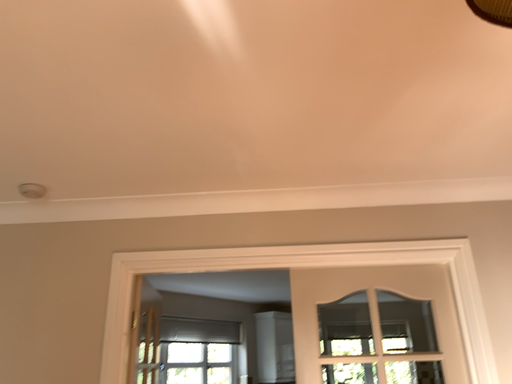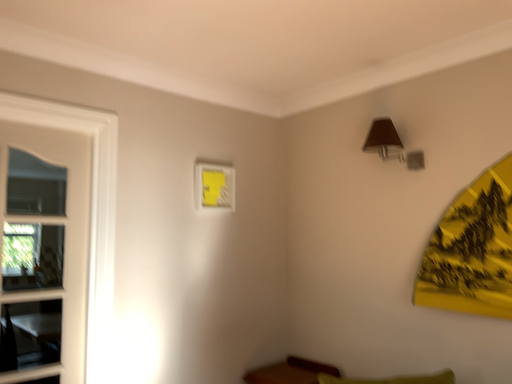
Question: How did the camera likely rotate when shooting the video?

Choices:
 (A) rotated right
 (B) rotated left

Answer: (A)